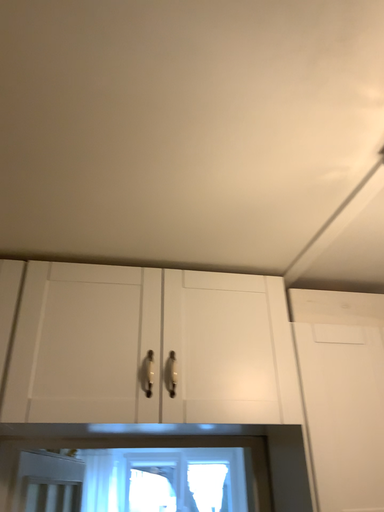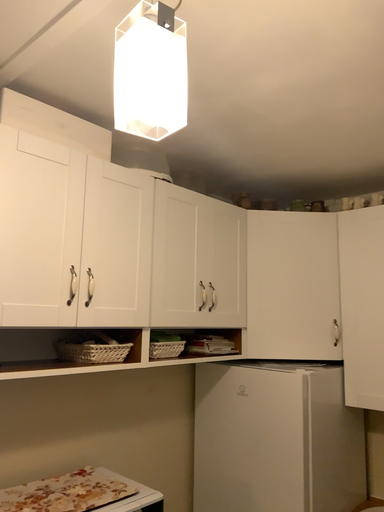
Question: Which way did the camera rotate in the video?

Choices:
 (A) rotated downward
 (B) rotated upward

Answer: (A)